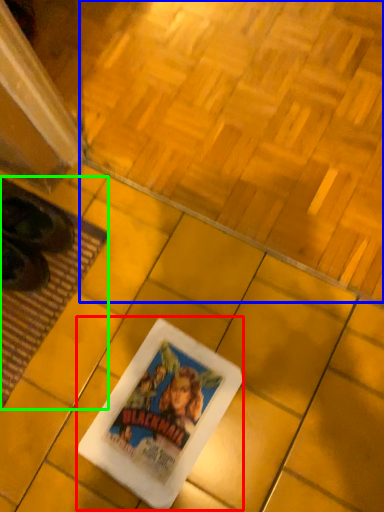
Question: Which object is positioned farthest from movie poster (highlighted by a red box)? Select from square (highlighted by a blue box) and mat (highlighted by a green box).

Choices:
 (A) square
 (B) mat

Answer: (A)